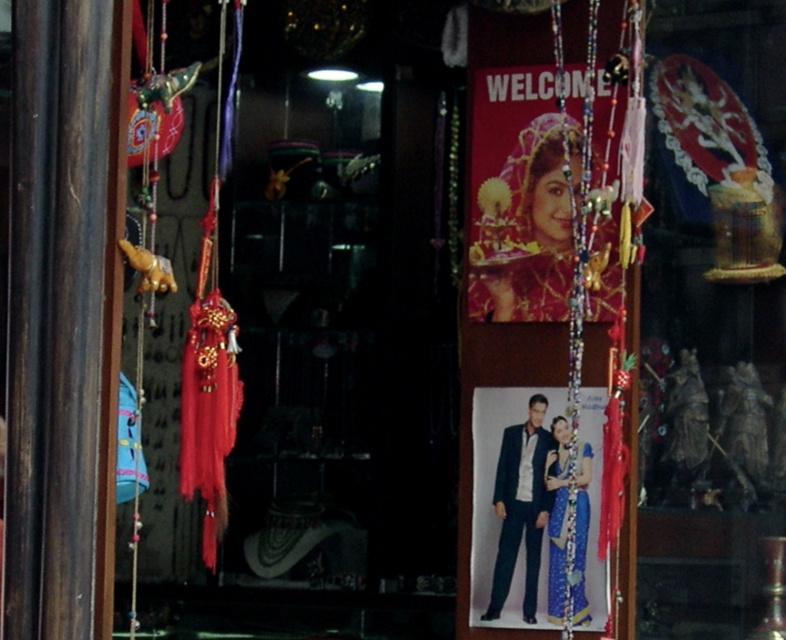
Is dark blue suit at center thinner than blue silk saree at center?

In fact, dark blue suit at center might be wider than blue silk saree at center.

Is dark blue suit at center positioned behind blue silk saree at center?

Yes, dark blue suit at center is behind blue silk saree at center.

Find the location of `dark blue suit at center`. dark blue suit at center is located at coordinates (520, 506).

Is matte gold jewelry at center shorter than blue silk saree at center?

No.

Does matte gold jewelry at center have a lesser width compared to blue silk saree at center?

In fact, matte gold jewelry at center might be wider than blue silk saree at center.

Between point (520, 136) and point (549, 456), which one is positioned behind?

The point (520, 136) is more distant.

Identify the location of matte gold jewelry at center. The width and height of the screenshot is (786, 640). (518, 220).

Can you confirm if matte gold jewelry at center is positioned above dark blue suit at center?

Indeed, matte gold jewelry at center is positioned over dark blue suit at center.

Is matte gold jewelry at center further to camera compared to dark blue suit at center?

No, matte gold jewelry at center is in front of dark blue suit at center.

Locate an element on the screen. matte gold jewelry at center is located at coordinates click(518, 220).